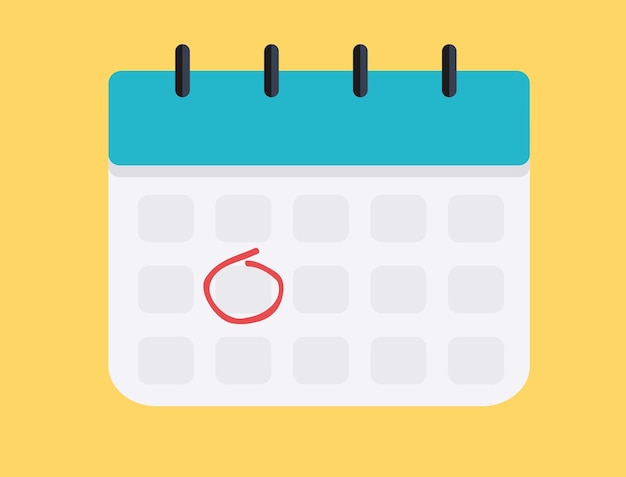
At what (x,y) coordinates should I click in order to perform the action: click on black calendar binders. Please return your answer as a coordinate pair (x, y). The height and width of the screenshot is (477, 626). Looking at the image, I should click on (187, 71), (269, 68), (356, 71), (449, 71).